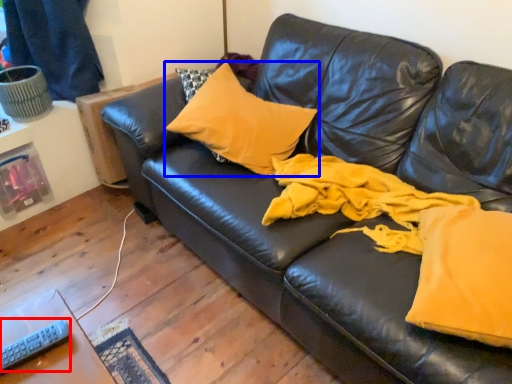
Question: Which of the following is the closest to the observer, remote (highlighted by a red box) or pillow (highlighted by a blue box)?

Choices:
 (A) remote
 (B) pillow

Answer: (A)